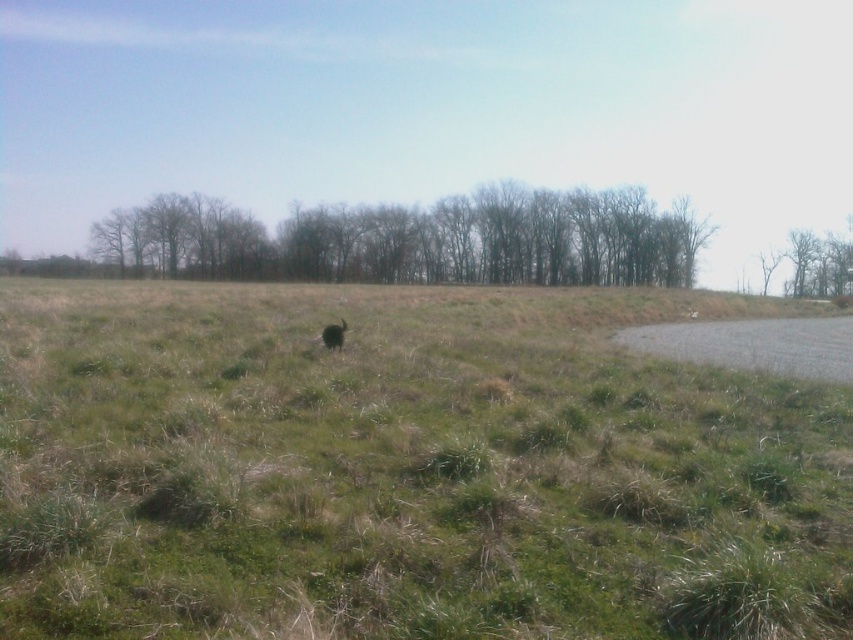
You are a hiker planning to cross the area. You see the green grassy field at center and the bare branches at center. Which one has a larger area in the image?

The bare branches at center have a larger area in the image since the green grassy field at center is smaller than them.

You are standing at the origin point in the image. The green grassy field at center is at coordinates 0.738, 0.474. Which direction should you move to reach it?

The green grassy field at center is located at coordinates (x=403, y=472), so you should move towards the center of the image to reach it.